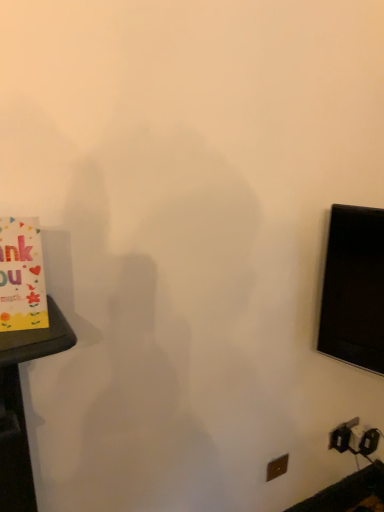
Question: Is brown plastic electric outlet at lower right inside or outside of yellow paper card at left?

Choices:
 (A) outside
 (B) inside

Answer: (A)

Question: Considering the relative positions of brown plastic electric outlet at lower right and yellow paper card at left in the image provided, is brown plastic electric outlet at lower right to the left or to the right of yellow paper card at left?

Choices:
 (A) left
 (B) right

Answer: (B)

Question: From their relative heights in the image, would you say brown plastic electric outlet at lower right is taller or shorter than yellow paper card at left?

Choices:
 (A) short
 (B) tall

Answer: (A)

Question: From the image's perspective, is yellow paper card at left above or below brown plastic electric outlet at lower right?

Choices:
 (A) below
 (B) above

Answer: (B)

Question: Is yellow paper card at left wider or thinner than brown plastic electric outlet at lower right?

Choices:
 (A) wide
 (B) thin

Answer: (A)

Question: Is point (0, 314) positioned closer to the camera than point (266, 470)?

Choices:
 (A) closer
 (B) farther

Answer: (A)

Question: Relative to brown plastic electric outlet at lower right, is yellow paper card at left in front or behind?

Choices:
 (A) behind
 (B) front

Answer: (B)